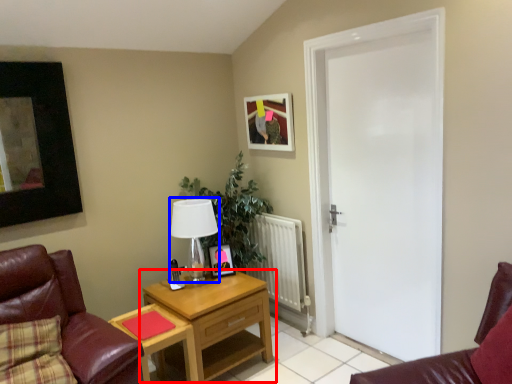
Question: Which object is further to the camera taking this photo, nightstand (highlighted by a red box) or table lamp (highlighted by a blue box)?

Choices:
 (A) nightstand
 (B) table lamp

Answer: (B)